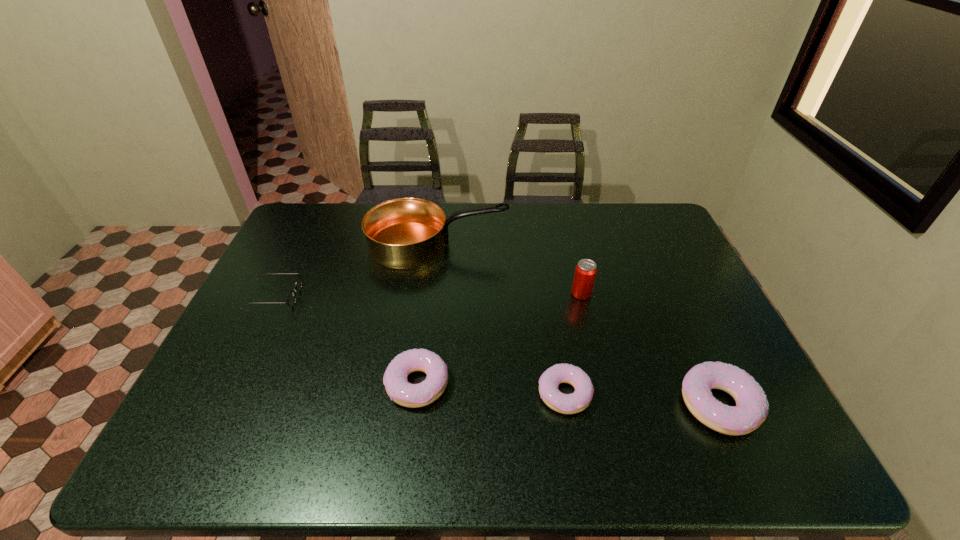
You are a GUI agent. You are given a task and a screenshot of the screen. Output one action in this format:
    pyautogui.click(x=<x>, y=<y>)
    Task: Click on the second shortest doughnut
    The height and width of the screenshot is (540, 960).
    Given the screenshot: What is the action you would take?
    pyautogui.click(x=406, y=394)

Where is `the fourth tallest object`? the fourth tallest object is located at coordinates (406, 394).

Locate an element on the screen. This screenshot has width=960, height=540. the fourth object from left to right is located at coordinates (579, 400).

The width and height of the screenshot is (960, 540). What are the coordinates of `the second doughnut from left to right` in the screenshot? It's located at (579, 400).

The width and height of the screenshot is (960, 540). I want to click on the rightmost object, so click(x=751, y=410).

Where is `the farthest object`? The height and width of the screenshot is (540, 960). the farthest object is located at coordinates (403, 233).

Locate an element on the screen. The image size is (960, 540). the tallest object is located at coordinates (403, 233).

Locate an element on the screen. the second object from right to left is located at coordinates (585, 272).

Where is `the fifth shortest object`? Image resolution: width=960 pixels, height=540 pixels. the fifth shortest object is located at coordinates (585, 272).

Locate an element on the screen. The height and width of the screenshot is (540, 960). spectacles is located at coordinates (291, 300).